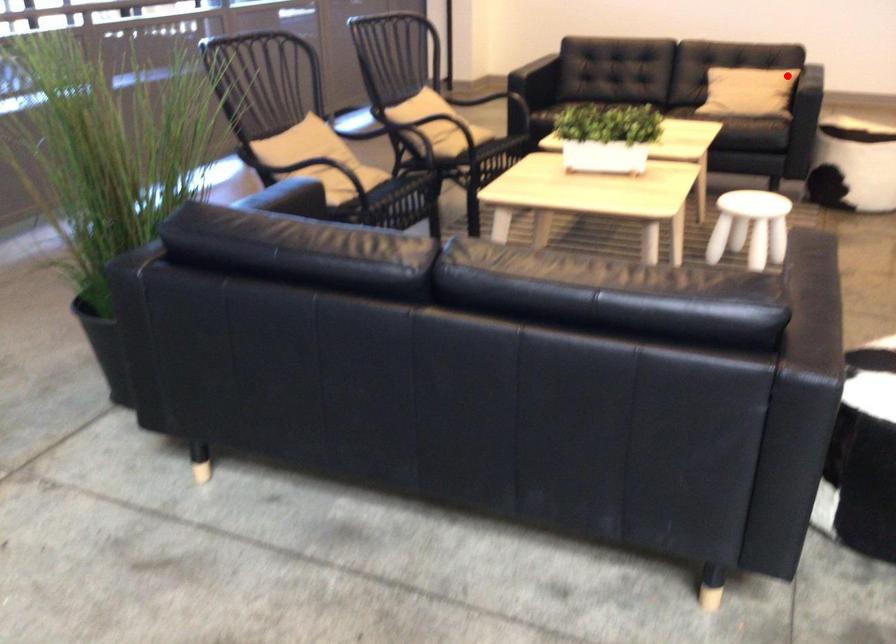
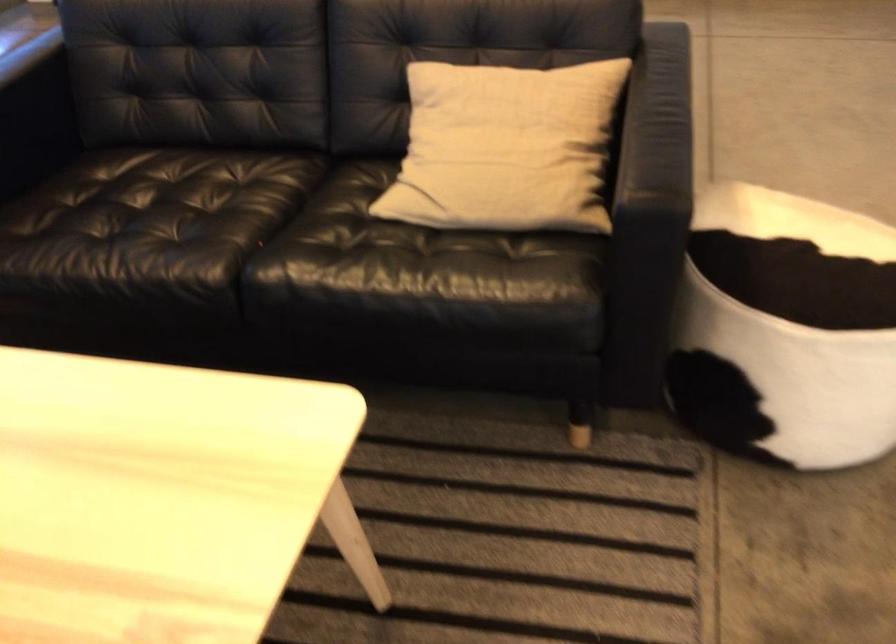
Question: I am providing you with two images of the same scene from different viewpoints. A red point is shown in image1. For the corresponding object point in image2, is it positioned nearer or farther from the camera?

Choices:
 (A) Nearer
 (B) Farther

Answer: (A)